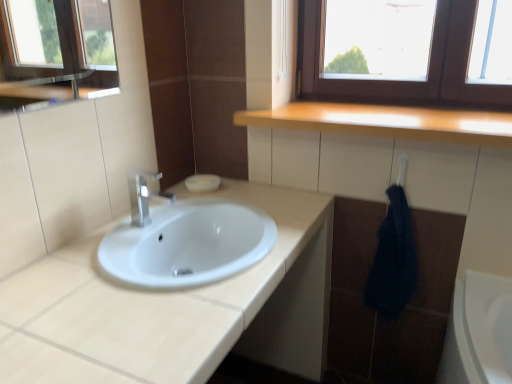
Question: Would you say light wood countertop at upper center is to the left or to the right of satin nickel faucet at center in the picture?

Choices:
 (A) left
 (B) right

Answer: (B)

Question: From the image's perspective, is light wood countertop at upper center located above or below satin nickel faucet at center?

Choices:
 (A) above
 (B) below

Answer: (A)

Question: Which object is positioned closest to the satin nickel faucet at center?

Choices:
 (A) white glossy sink at center
 (B) light wood countertop at upper center
 (C) dark blue textured towel at right

Answer: (A)

Question: Which of these objects is positioned farthest from the white glossy sink at center?

Choices:
 (A) satin nickel faucet at center
 (B) light wood countertop at upper center
 (C) dark blue textured towel at right

Answer: (B)